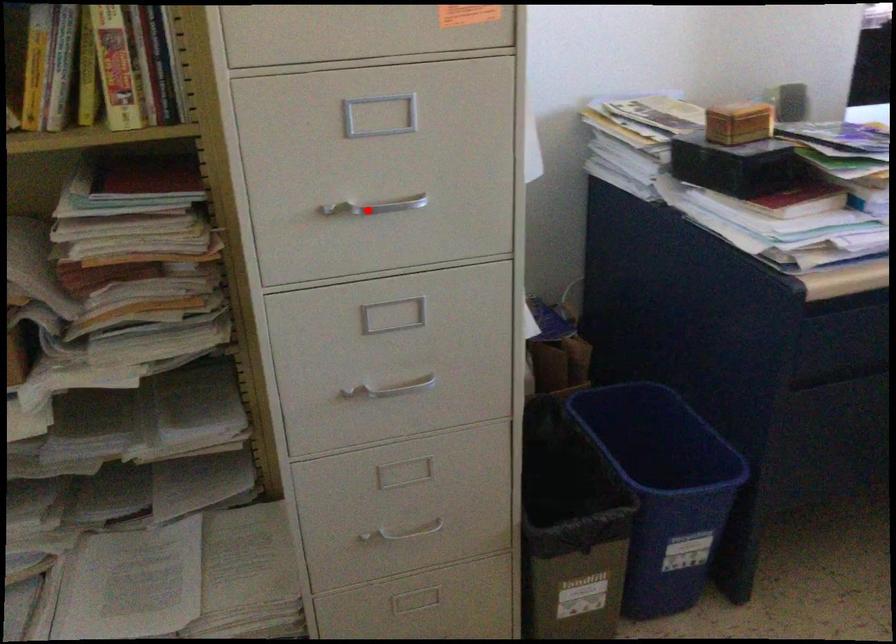
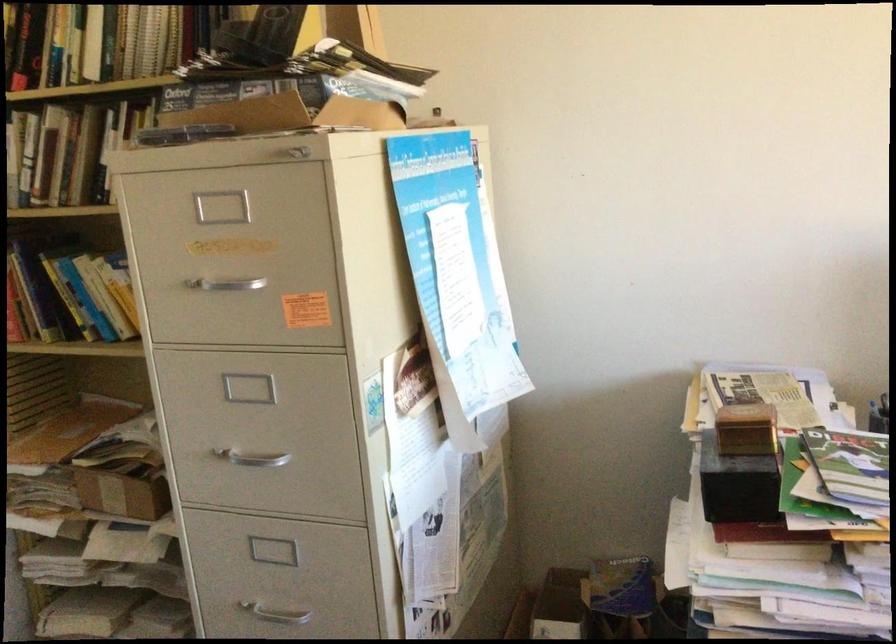
Question: I am providing you with two images of the same scene from different viewpoints. A red point is marked on the first image. Is the red point's position out of view in image 2?

Choices:
 (A) Yes
 (B) No

Answer: (B)